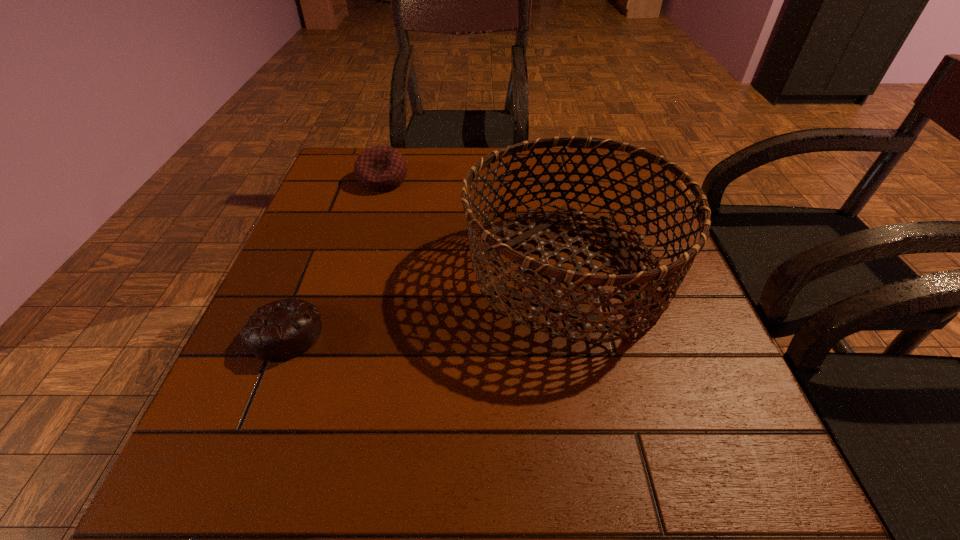
Find the location of `free point between the farthest object and the nearer beanbag`. free point between the farthest object and the nearer beanbag is located at coordinates (334, 256).

The height and width of the screenshot is (540, 960). I want to click on object that stands as the second closest to the shortest object, so click(380, 168).

Locate an element on the screen. object that is the second closest to the tallest object is located at coordinates (279, 331).

Locate an element on the screen. vacant region that satisfies the following two spatial constraints: 1. on the front side of the rightmost object; 2. on the right side of the second tallest object is located at coordinates (356, 269).

Locate an element on the screen. The image size is (960, 540). free spot that satisfies the following two spatial constraints: 1. on the front side of the farthest object; 2. on the right side of the basket is located at coordinates 356,269.